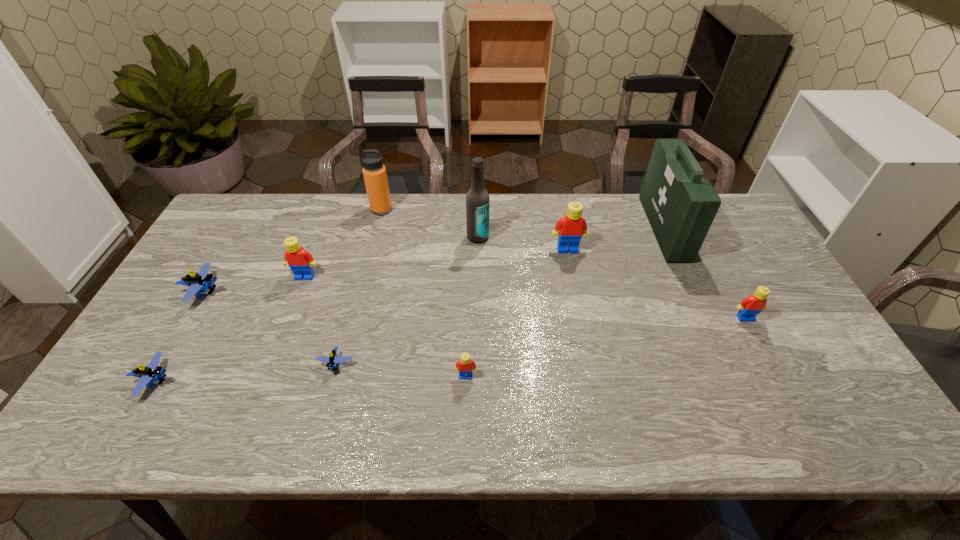
Find the location of `Lego that is the fifth closest one to the farthest Lego`. Lego that is the fifth closest one to the farthest Lego is located at coordinates (202, 281).

The width and height of the screenshot is (960, 540). What are the coordinates of `red Lego object that ranks as the second closest to the first-aid kit` in the screenshot? It's located at (569, 230).

Find the location of a particular element. the third closest red Lego to the thermos bottle is located at coordinates (465, 365).

Select which blue Lego is the closest to the beer bottle. Please provide its 2D coordinates. Your answer should be formatted as a tuple, i.e. [(x, y)], where the tuple contains the x and y coordinates of a point satisfying the conditions above.

[(332, 359)]

Identify which blue Lego is located as the second nearest to the second shortest object. Please provide its 2D coordinates. Your answer should be formatted as a tuple, i.e. [(x, y)], where the tuple contains the x and y coordinates of a point satisfying the conditions above.

[(332, 359)]

The image size is (960, 540). What are the coordinates of `free location that satisfies the following two spatial constraints: 1. on the front-facing side of the shortest object; 2. on the front-facing side of the second shortest Lego` in the screenshot? It's located at (332, 381).

I want to click on vacant space that satisfies the following two spatial constraints: 1. on the side of the beer bottle with the label; 2. on the front-facing side of the second smallest blue Lego, so click(477, 381).

In order to click on free location that satisfies the following two spatial constraints: 1. on the face of the second red Lego from left to right; 2. on the front-facing side of the ninth tallest object in this screenshot , I will do point(466,381).